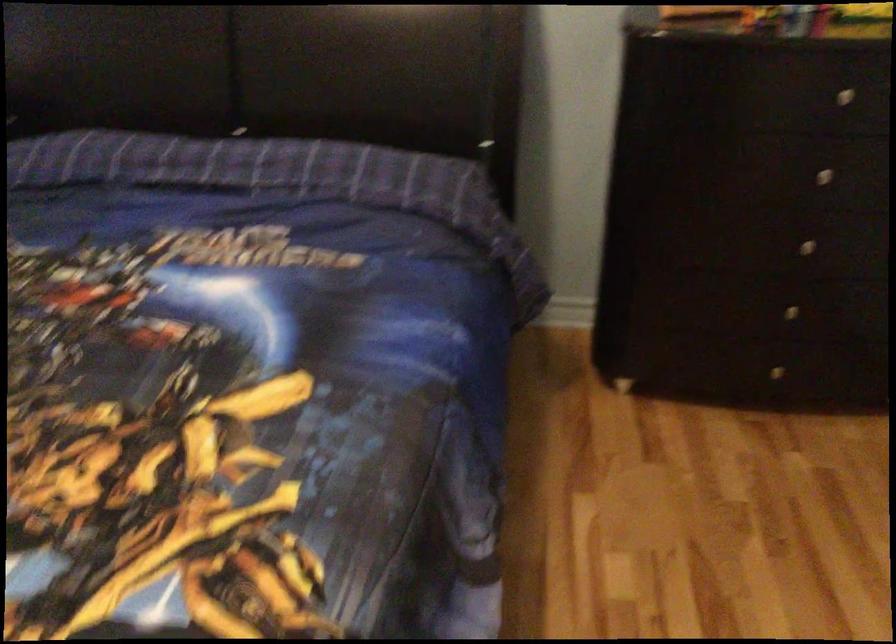
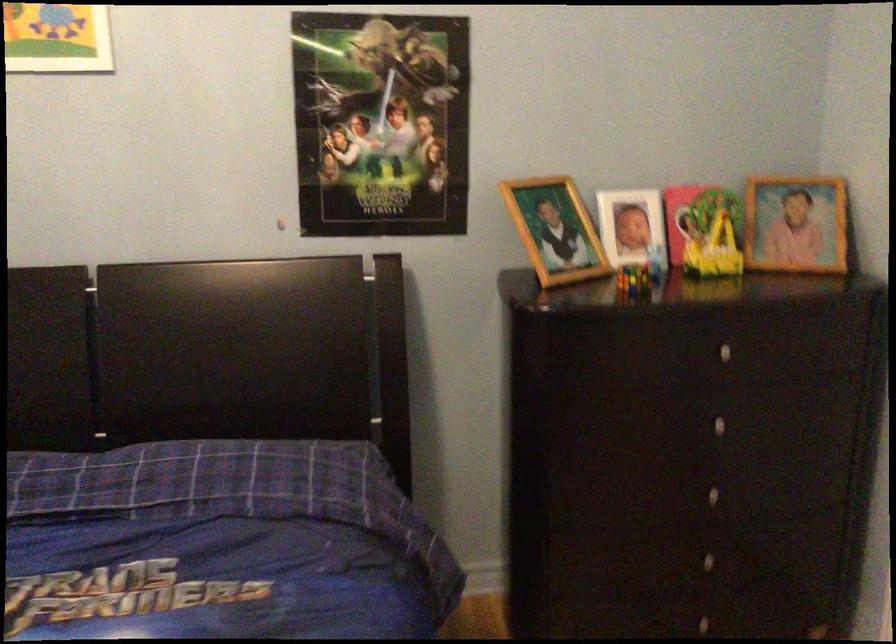
In the second image, find the point that corresponds to [795,269] in the first image.

(711, 516)